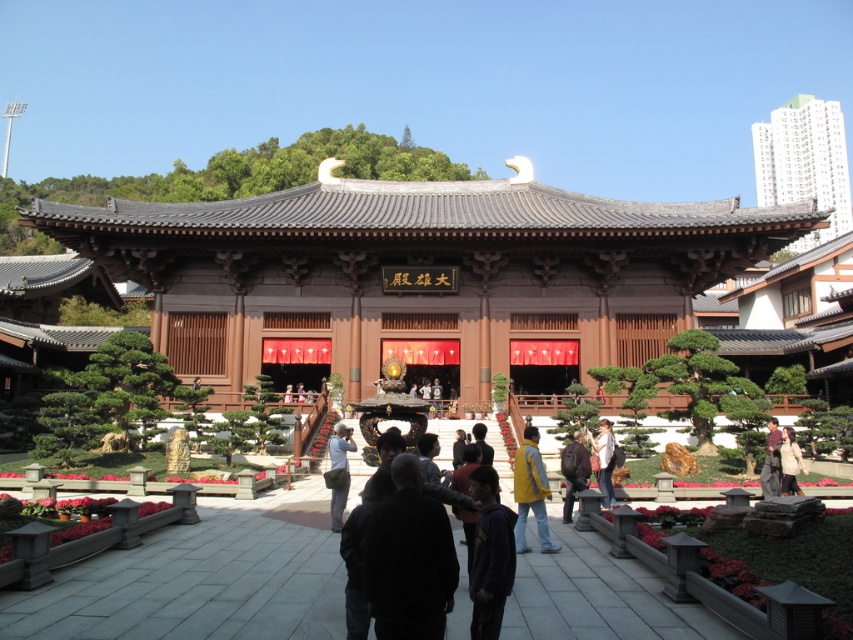
Who is lower down, yellow fabric jacket at center or brown leather jacket at center?

yellow fabric jacket at center is lower down.

Can you confirm if yellow fabric jacket at center is positioned to the right of brown leather jacket at center?

No, yellow fabric jacket at center is not to the right of brown leather jacket at center.

Image resolution: width=853 pixels, height=640 pixels. Find the location of `yellow fabric jacket at center`. yellow fabric jacket at center is located at coordinates (531, 492).

Does point (538, 532) come closer to viewer compared to point (331, 465)?

Yes, point (538, 532) is in front of point (331, 465).

Can you confirm if yellow fabric jacket at center is taller than light blue denim jeans at center?

No, yellow fabric jacket at center is not taller than light blue denim jeans at center.

I want to click on yellow fabric jacket at center, so click(x=531, y=492).

Is dark blue hoodie at center to the left of light brown leather jacket at lower right from the viewer's perspective?

Yes, dark blue hoodie at center is to the left of light brown leather jacket at lower right.

Does point (495, 584) come closer to viewer compared to point (787, 435)?

Yes, it is in front of point (787, 435).

At what (x,y) coordinates should I click in order to perform the action: click on dark blue hoodie at center. Please return your answer as a coordinate pair (x, y). Image resolution: width=853 pixels, height=640 pixels. Looking at the image, I should click on (490, 556).